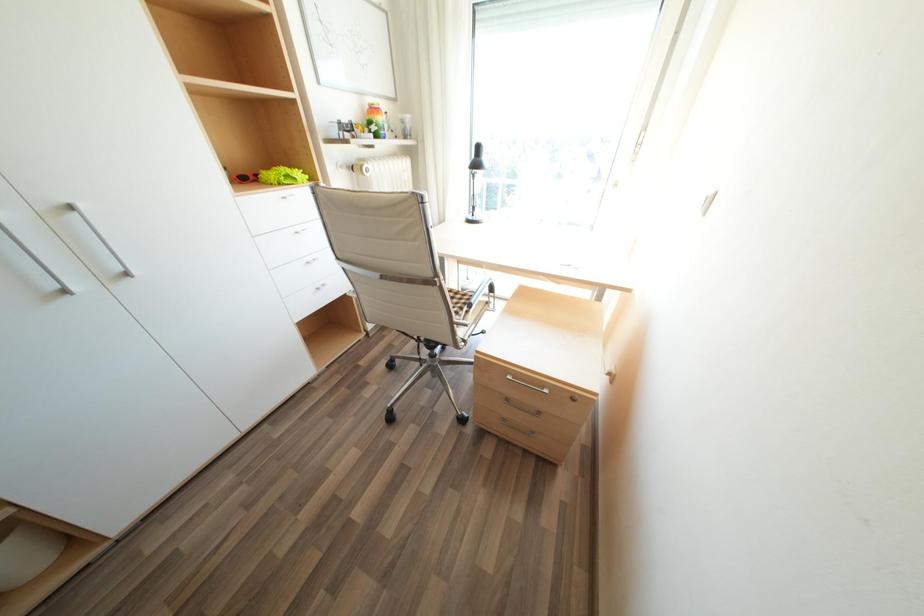
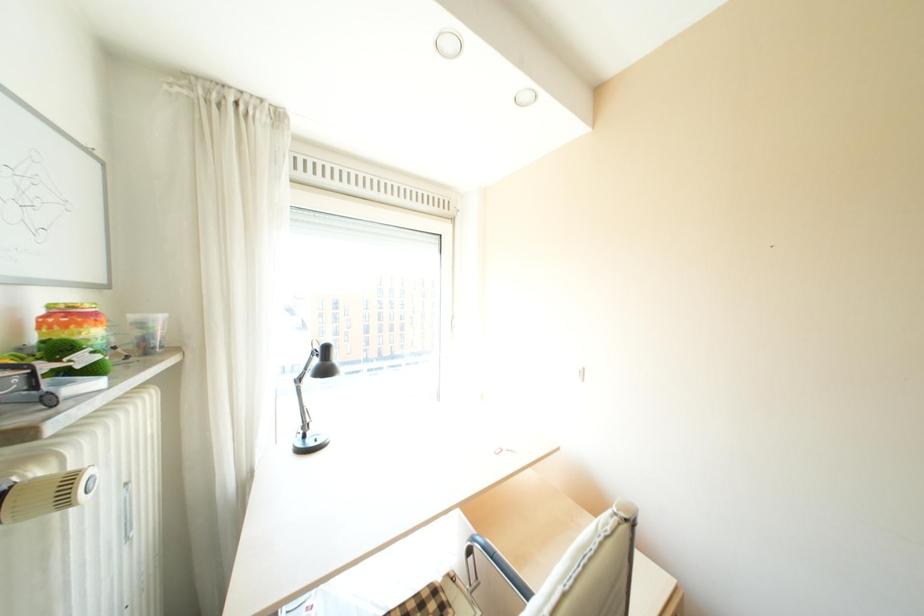
Question: The camera is either moving clockwise (left) or counter-clockwise (right) around the object. The first image is from the beginning of the video and the second image is from the end. Is the camera moving left or right when shooting the video?

Choices:
 (A) Left
 (B) Right

Answer: (A)